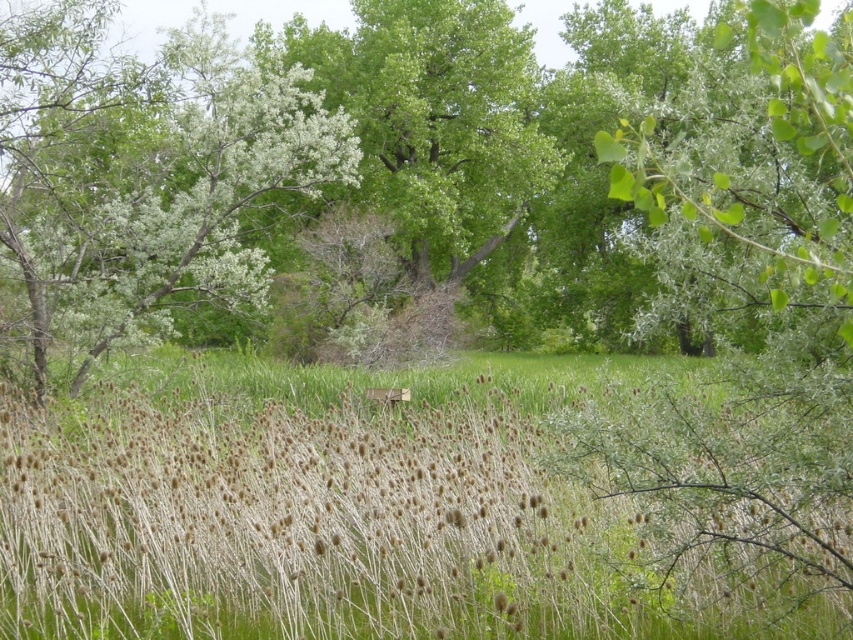
Question: Which object is closer to the camera taking this photo?

Choices:
 (A) green leafy tree at center
 (B) green leafy tree at upper left
 (C) brown dry grass at center

Answer: (A)

Question: Based on their relative distances, which object is nearer to the brown dry grass at center?

Choices:
 (A) green leafy tree at center
 (B) green leafy tree at upper left

Answer: (B)

Question: Is brown dry grass at center above green leafy tree at center?

Choices:
 (A) yes
 (B) no

Answer: (B)

Question: Is green leafy tree at upper left to the right of green leafy tree at center from the viewer's perspective?

Choices:
 (A) yes
 (B) no

Answer: (B)

Question: Is brown dry grass at center thinner than green leafy tree at upper left?

Choices:
 (A) no
 (B) yes

Answer: (A)

Question: Which object is positioned closest to the green leafy tree at center?

Choices:
 (A) brown dry grass at center
 (B) green leafy tree at upper left

Answer: (A)